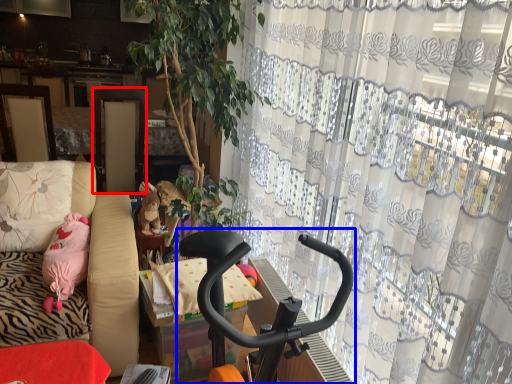
Question: Among these objects, which one is nearest to the camera, screen door (highlighted by a red box) or baby carriage (highlighted by a blue box)?

Choices:
 (A) screen door
 (B) baby carriage

Answer: (B)